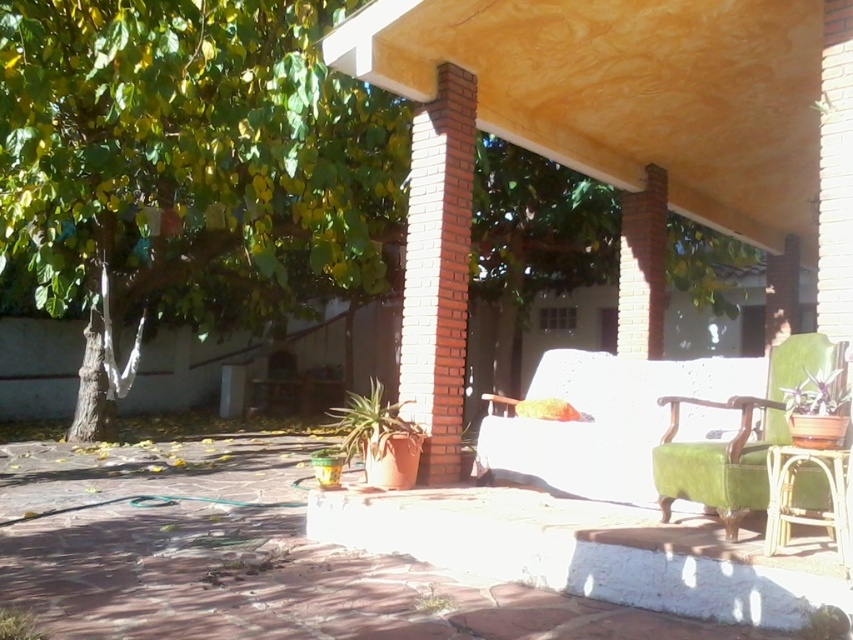
You are standing on the patio and want to take a photo of the green leafy tree at upper left. Which direction should you face to capture it in your shot?

You should face the upper left direction to capture the green leafy tree at upper left in your shot since it is located at point (x=190, y=157) which corresponds to the upper left area of the image.

You are planning to place a new rectangular side table between the velvet green armchair at center and the green matte plant at right. The table is 1.2 meters wide. Can the table fit between them without touching either object?

The velvet green armchair at center is wider than the green matte plant at right. However, the exact distance between them isn